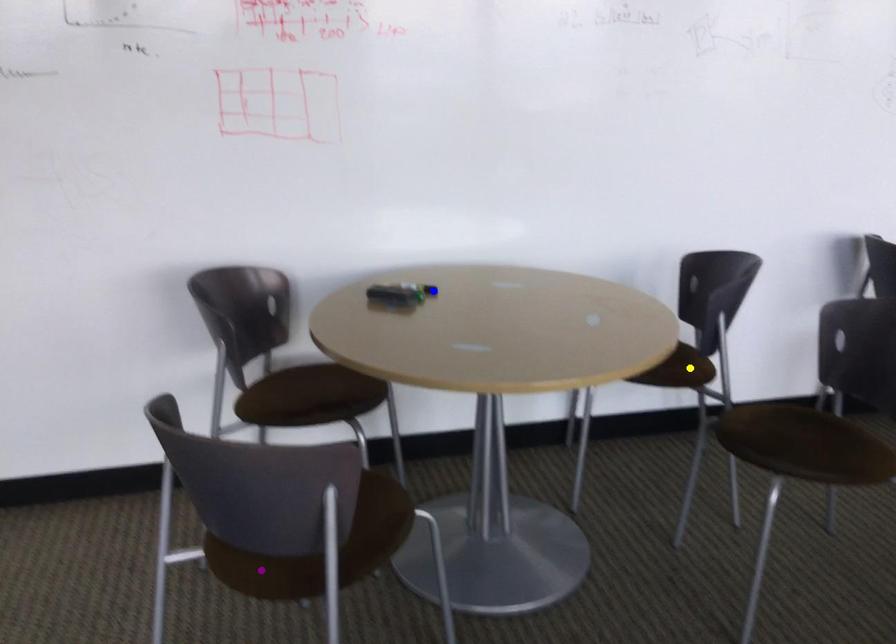
From the picture: Order these from nearest to farthest:
1. purple point
2. yellow point
3. blue point

purple point, blue point, yellow point